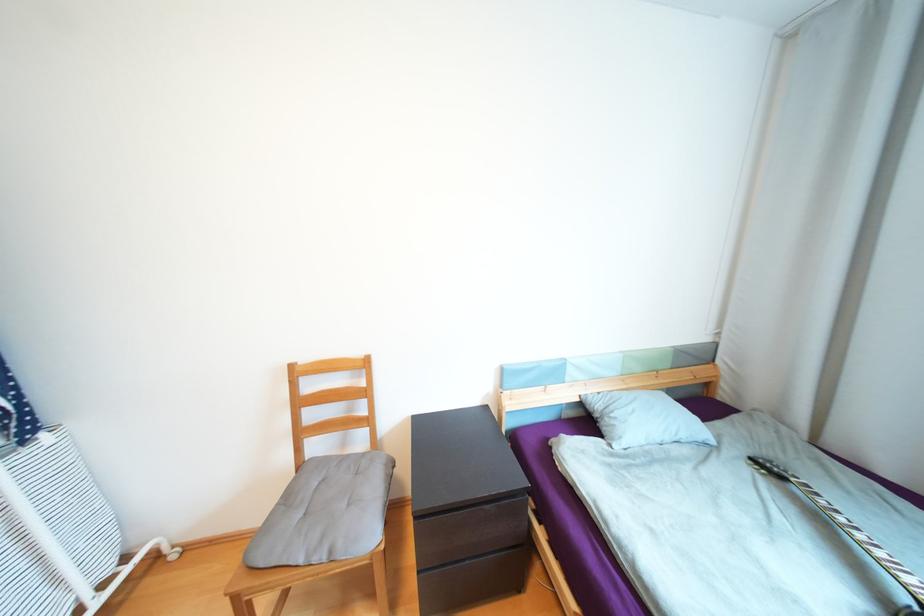
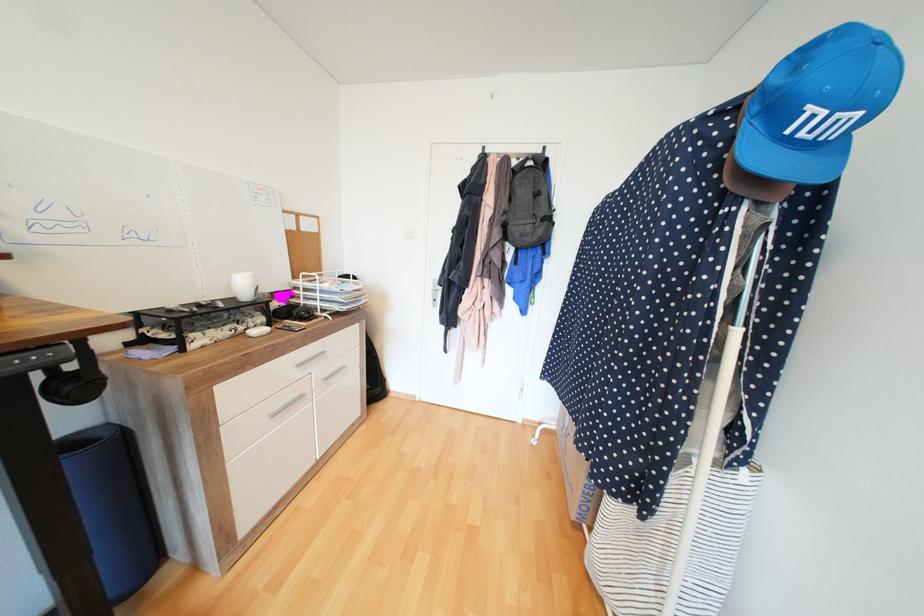
Find the pixel in the second image that matches point (49, 435) in the first image.

(750, 471)